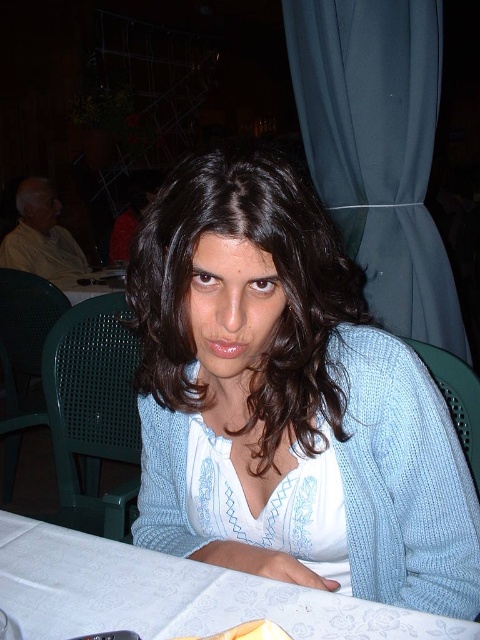
Question: Is light blue knit sweater at center to the right of white fabric table at lower center from the viewer's perspective?

Choices:
 (A) yes
 (B) no

Answer: (A)

Question: Can you confirm if light blue knit sweater at center is positioned above white fabric table at lower center?

Choices:
 (A) yes
 (B) no

Answer: (A)

Question: Which object is farther from the camera taking this photo?

Choices:
 (A) light blue knit sweater at center
 (B) white fabric table at lower center

Answer: (B)

Question: Does light blue knit sweater at center have a larger size compared to white fabric table at lower center?

Choices:
 (A) no
 (B) yes

Answer: (B)

Question: Among these points, which one is nearest to the camera?

Choices:
 (A) (435, 540)
 (B) (35, 552)

Answer: (A)